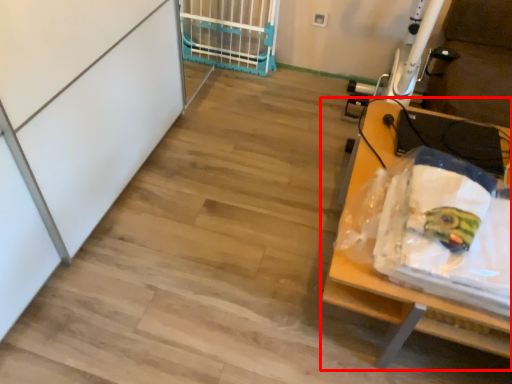
Question: Considering the relative positions of furniture (annotated by the red box) and cage in the image provided, where is furniture (annotated by the red box) located with respect to the staircase?

Choices:
 (A) left
 (B) right

Answer: (B)